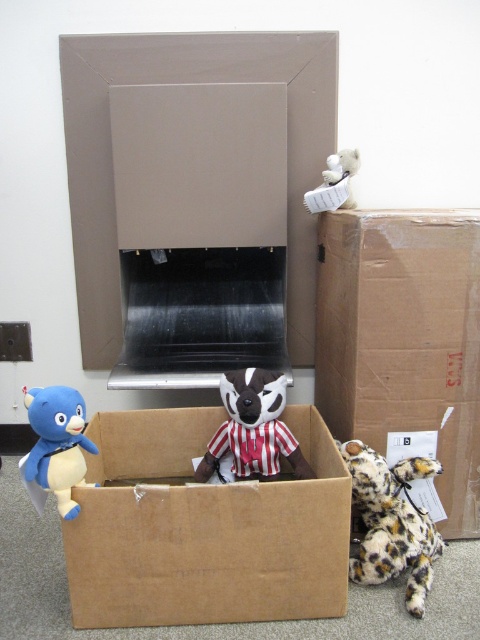
You are organizing a toy store and need to place a new shelf that is 1 meter tall. The shelf must be placed between the brown cardboard box at center and the striped plush toy at center. Can the shelf fit between them vertically?

The brown cardboard box at center is closer to the viewer than striped plush toy at center, so the vertical space between them is sufficient for the 1 meter tall shelf.

Based on the photo, you are standing in front of a cardboard box with two points marked on the floor. The first point is at coordinates point (279, 492) and the second point is at point (247, 428). Which point is closer to you?

Point (279, 492) is in front of point (247, 428), so it is closer to you.

You are trying to place a new toy on the shelf behind the matte cardboard box at center and the striped plush toy at center. Which object should you move first to access the shelf?

You should move the matte cardboard box at center first because it is closer to you than the striped plush toy at center, so moving it first will allow access to the shelf behind both objects.